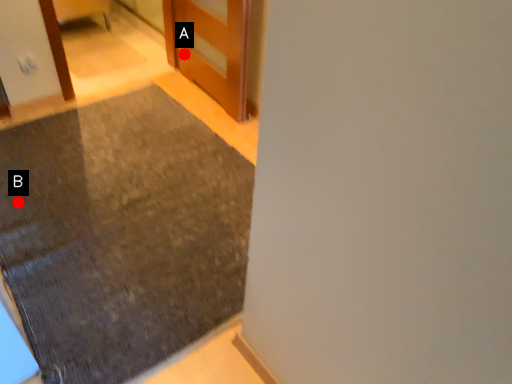
Question: Two points are circled on the image, labeled by A and B beside each circle. Which point is farther from the camera taking this photo?

Choices:
 (A) A is further
 (B) B is further

Answer: (A)